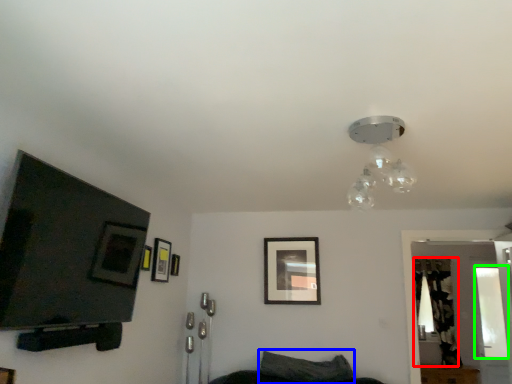
Question: Which object is positioned farthest from curtain (highlighted by a red box)? Select from pillow (highlighted by a blue box) and window (highlighted by a green box).

Choices:
 (A) pillow
 (B) window

Answer: (A)